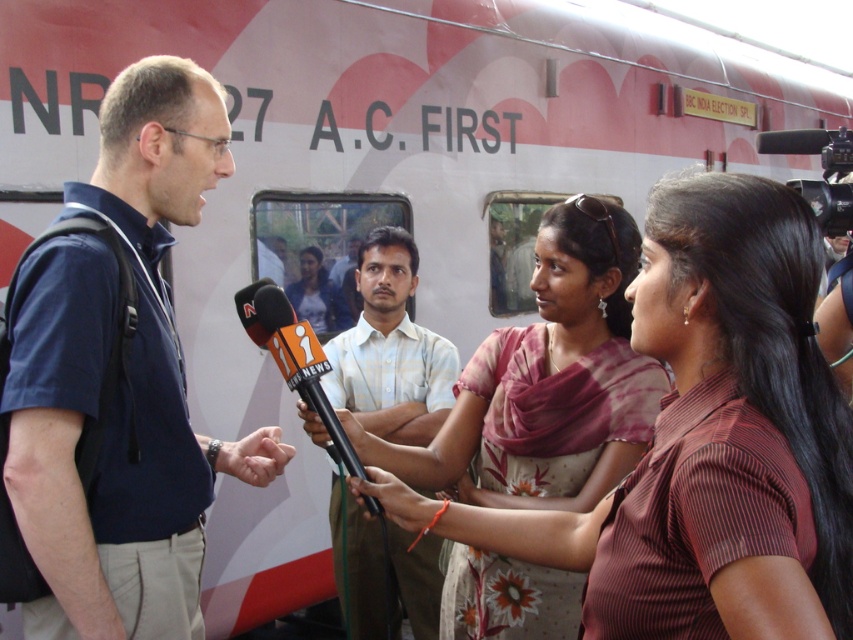
You are a photographer at the scene. You need to capture a photo that includes both the light pink fabric saree at center and the black plastic video camera at upper right. Based on their positions, where should you position the camera to ensure both objects are in the frame?

Since the light pink fabric saree at center is below the black plastic video camera at upper right, you should position the camera so that it can capture the lower area where the saree is located while still including the camera at the upper right in the frame.

Based on the scene description, where is the blue fabric shirt at left located in terms of coordinates?

The blue fabric shirt at left is located at coordinates point (122, 385).